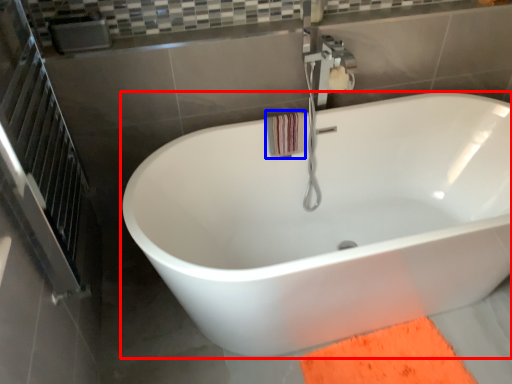
Question: Which point is closer to the camera, bathtub (highlighted by a red box) or beach towel (highlighted by a blue box)?

Choices:
 (A) bathtub
 (B) beach towel

Answer: (A)